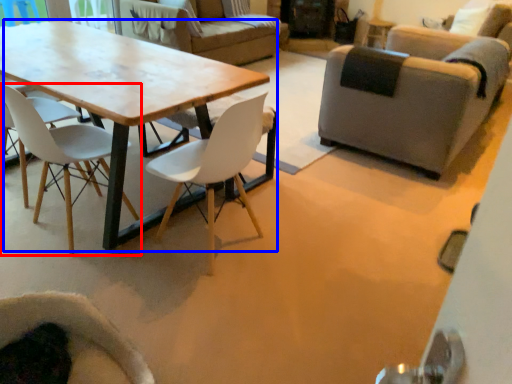
Question: Which object is closer to the camera taking this photo, chair (highlighted by a red box) or coffee table (highlighted by a blue box)?

Choices:
 (A) chair
 (B) coffee table

Answer: (B)